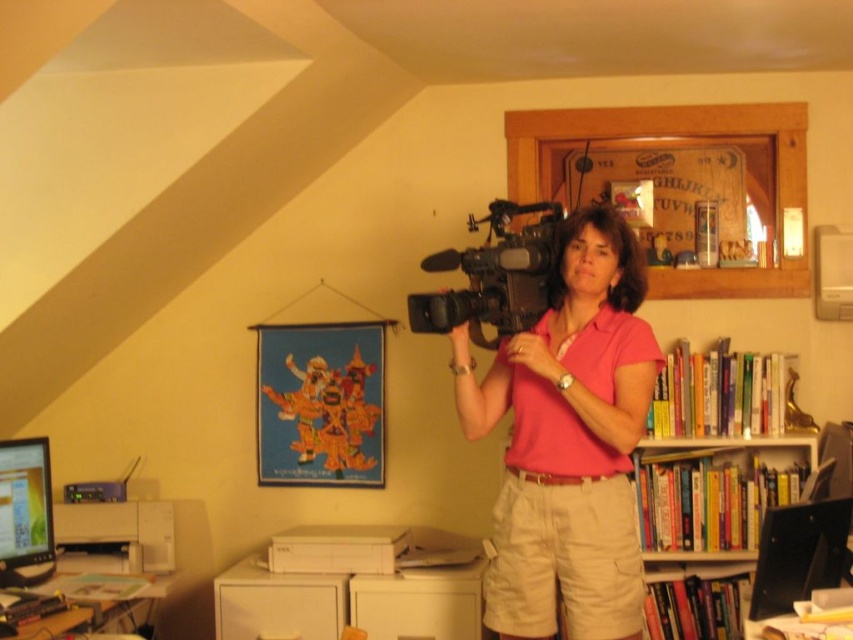
Question: Which point is closer to the camera?

Choices:
 (A) (537, 298)
 (B) (6, 586)
 (C) (164, 572)

Answer: (A)

Question: Can you confirm if pink cotton shirt at center is wider than white plastic printer at lower left?

Choices:
 (A) yes
 (B) no

Answer: (A)

Question: Where is pink cotton shirt at center located in relation to white plastic printer at lower left in the image?

Choices:
 (A) left
 (B) right

Answer: (B)

Question: Is black plastic video camera at center behind matte black monitor at lower left?

Choices:
 (A) no
 (B) yes

Answer: (A)

Question: Which of these objects is positioned farthest from the hardcover books at right?

Choices:
 (A) pink cotton shirt at center
 (B) matte black monitor at lower left
 (C) white plastic printer at lower left

Answer: (B)

Question: Which of the following is the farthest from the observer?

Choices:
 (A) hardcover books at right
 (B) matte black monitor at lower left

Answer: (A)